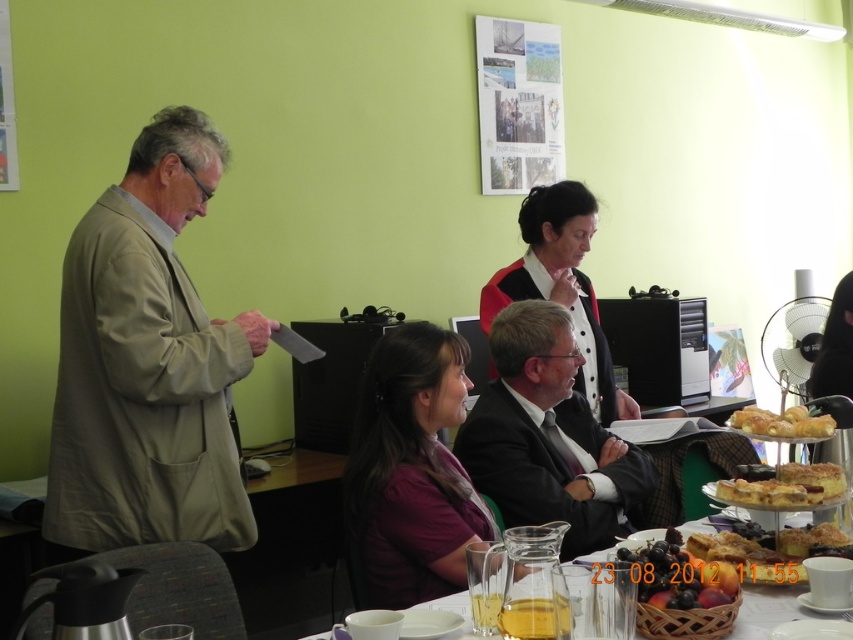
You are organizing a formal event and need to decide the order of clothing items on a rack. Given the purple satin blouse at center and dark suit at center, which one should be placed to the left if you want to mirror the arrangement in the image?

The purple satin blouse at center should be placed to the left of the dark suit at center to mirror the arrangement in the image, as it is already positioned on the left side of the dark suit at center in the original setup.

You are standing in the meeting room and want to reach both the point at coordinates (54, 429) and the point at coordinates (793, 477). Which point is closer to you?

The point at coordinates (54, 429) is closer to you because it is further to the viewer than the point at coordinates (793, 477).